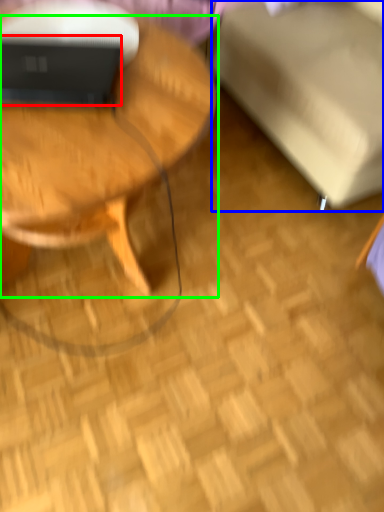
Question: Which is farther away from laptop (highlighted by a red box)? swivel chair (highlighted by a blue box) or coffee table (highlighted by a green box)?

Choices:
 (A) swivel chair
 (B) coffee table

Answer: (A)